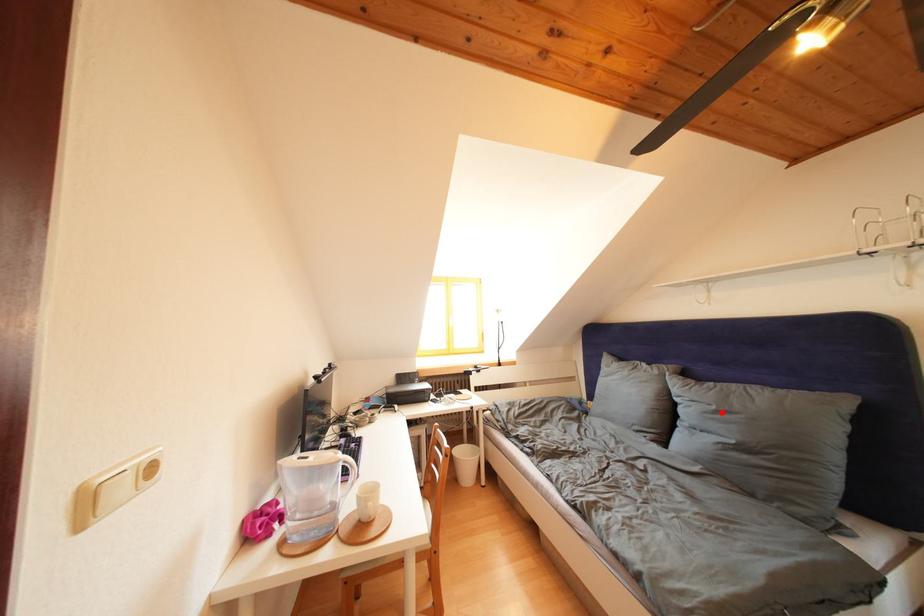
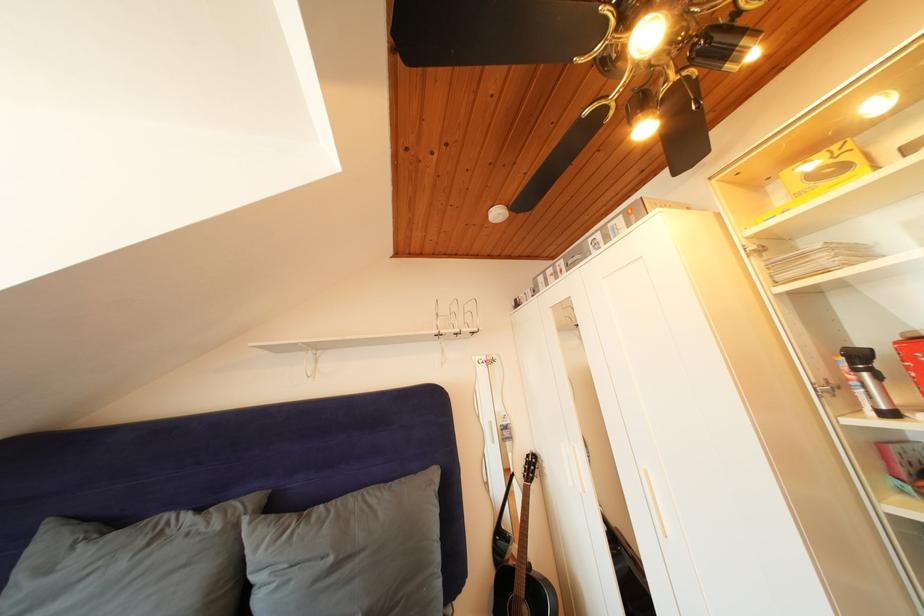
The point at the highlighted location is marked in the first image. Where is the corresponding point in the second image?

(338, 565)